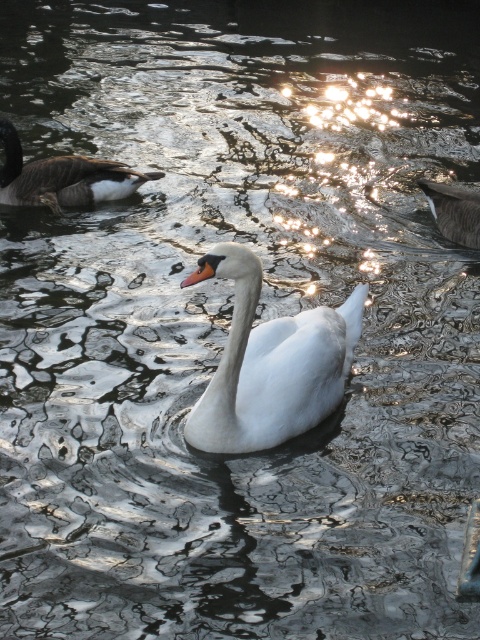
Question: Is white glossy swan at center wider than brown fuzzy duck at upper left?

Choices:
 (A) no
 (B) yes

Answer: (A)

Question: Among these objects, which one is farthest from the camera?

Choices:
 (A) white glossy swan at center
 (B) brown fuzzy duck at upper right

Answer: (B)

Question: Which of these objects is positioned farthest from the brown fuzzy duck at upper right?

Choices:
 (A) brown fuzzy duck at upper left
 (B) white glossy swan at center

Answer: (B)

Question: Which object is the farthest from the brown fuzzy duck at upper left?

Choices:
 (A) brown fuzzy duck at upper right
 (B) white glossy swan at center

Answer: (B)

Question: Considering the relative positions of white glossy swan at center and brown fuzzy duck at upper left in the image provided, where is white glossy swan at center located with respect to brown fuzzy duck at upper left?

Choices:
 (A) right
 (B) left

Answer: (A)

Question: Can you confirm if white glossy swan at center is wider than brown fuzzy duck at upper left?

Choices:
 (A) yes
 (B) no

Answer: (B)